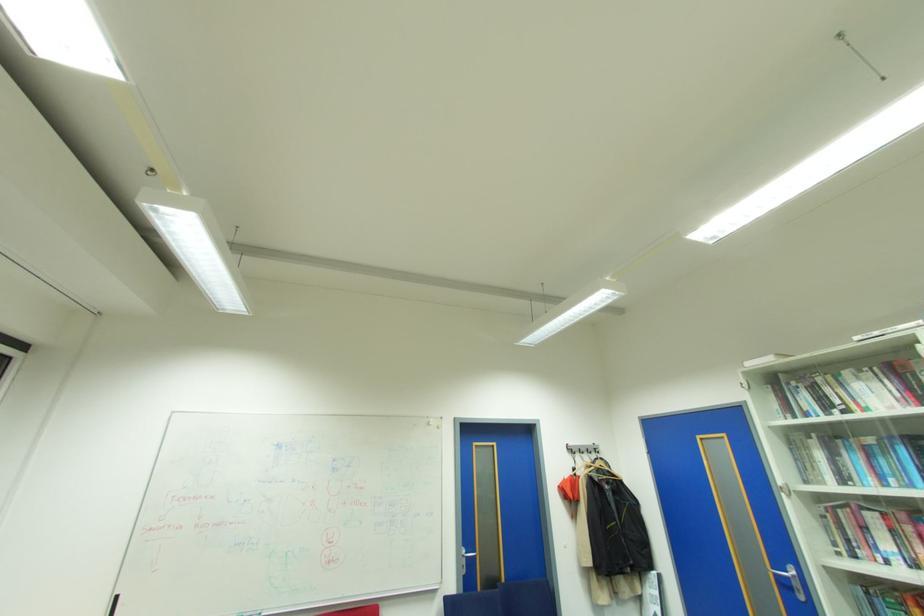
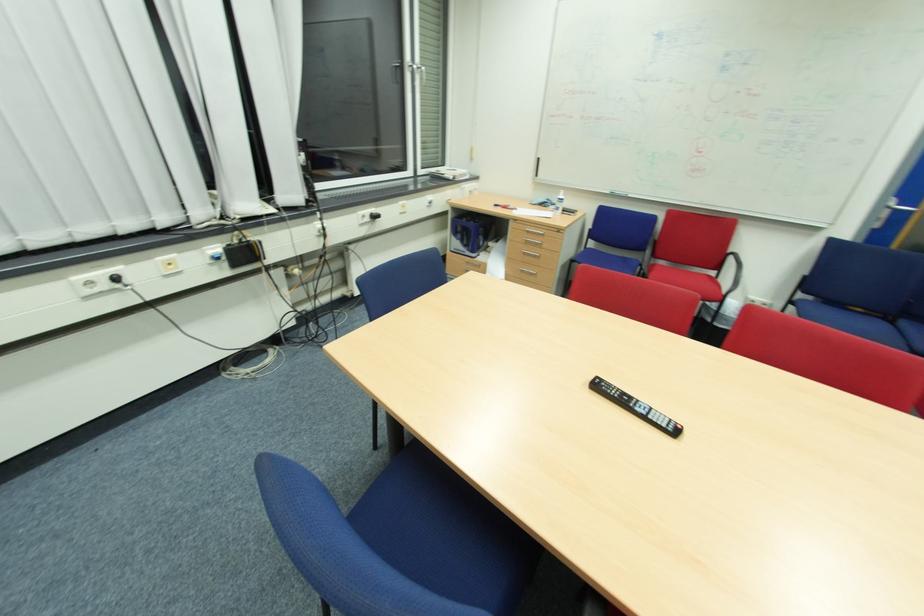
The point at (468, 556) is marked in the first image. Where is the corresponding point in the second image?

(894, 206)